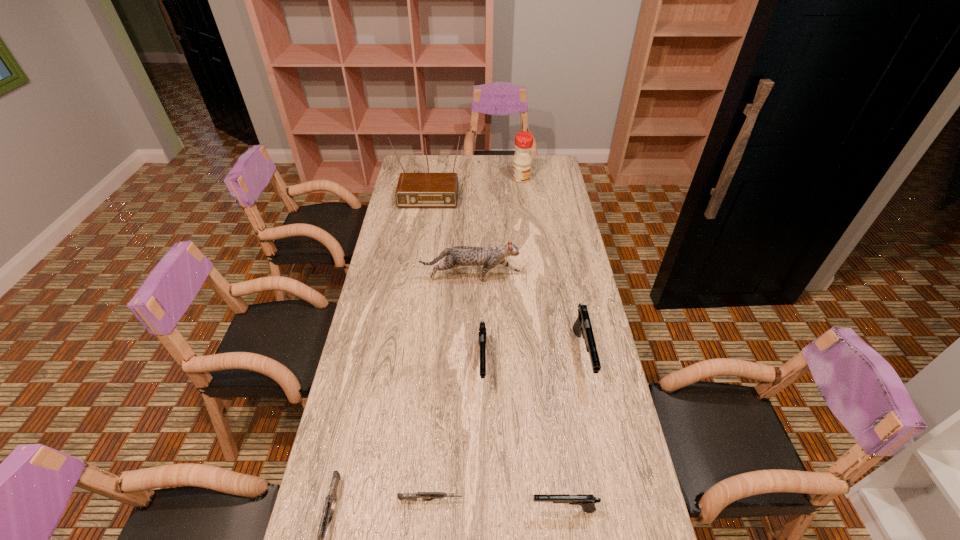
Choose which black gun is the nearest neighbor to the rightmost object. Please provide its 2D coordinates. Your answer should be formatted as a tuple, i.e. [(x, y)], where the tuple contains the x and y coordinates of a point satisfying the conditions above.

[(482, 334)]

I want to click on the second closest grey gun to the rightmost gun, so click(327, 514).

Point out which grey gun is positioned as the nearest to the radio_receiver. Please provide its 2D coordinates. Your answer should be formatted as a tuple, i.e. [(x, y)], where the tuple contains the x and y coordinates of a point satisfying the conditions above.

[(327, 514)]